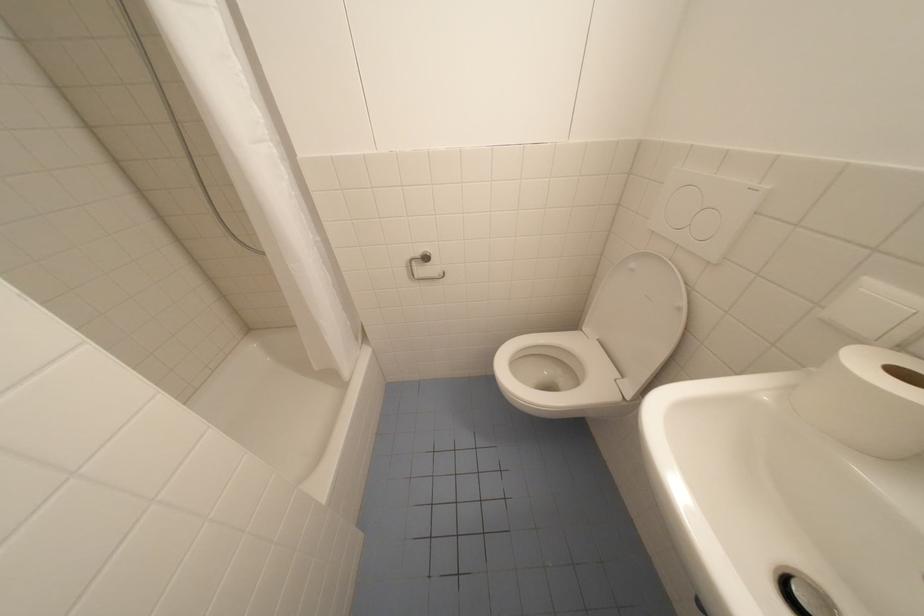
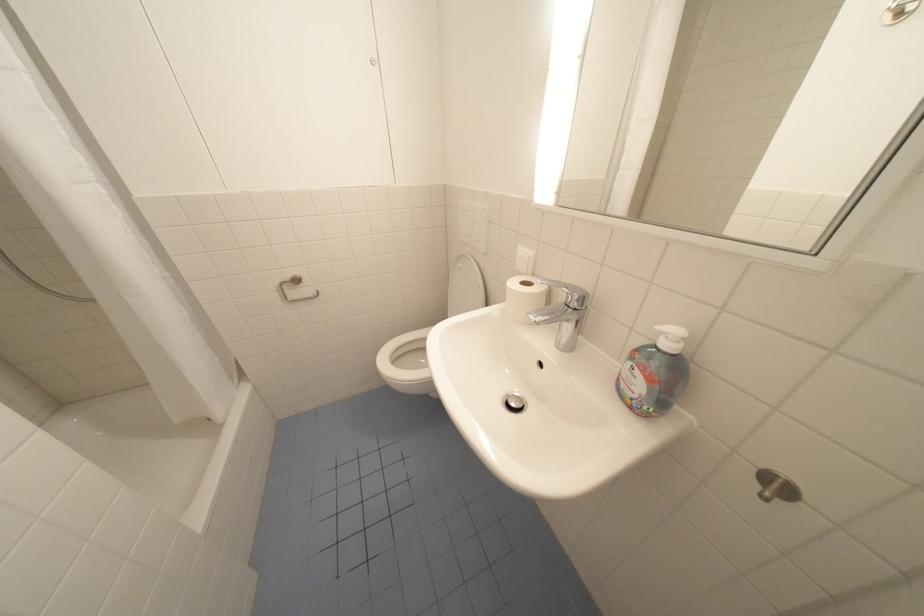
Where in the second image is the point corresponding to pixel 640 265 from the first image?

(468, 265)